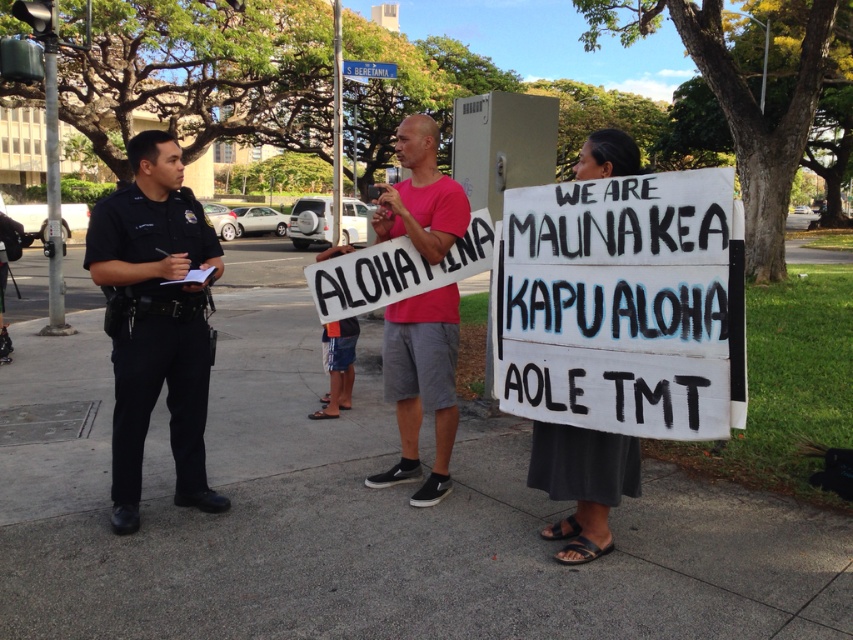
You are a photographer standing at the edge of the scene. You want to capture a photo where the gray concrete pavement at center is visible just below the pink fabric shirt at center. Is this possible based on the scene description?

Yes, the gray concrete pavement at center is located below the pink fabric shirt at center, so positioning the camera to include both elements in that arrangement is feasible.

You are a photographer trying to capture the protest scene. You want to ensure both the white painted wood sign at lower right and the black uniform at center are visible in your shot. Which object should you focus on to frame the shot properly?

The white painted wood sign at lower right occupies less space than the black uniform at center, so you should focus on the black uniform at center to ensure both are visible in the frame.

Looking at this image, you are a delivery person with a cart that is 1.5 meters wide. You need to navigate through the space between the white painted wood sign at lower right and the black uniform at center to reach the sidewalk on the other side. Will your cart fit through the space?

The distance between the white painted wood sign at lower right and the black uniform at center is 2.01 meters. Since your cart is 1.5 meters wide, it will fit through the space as there is enough width available.